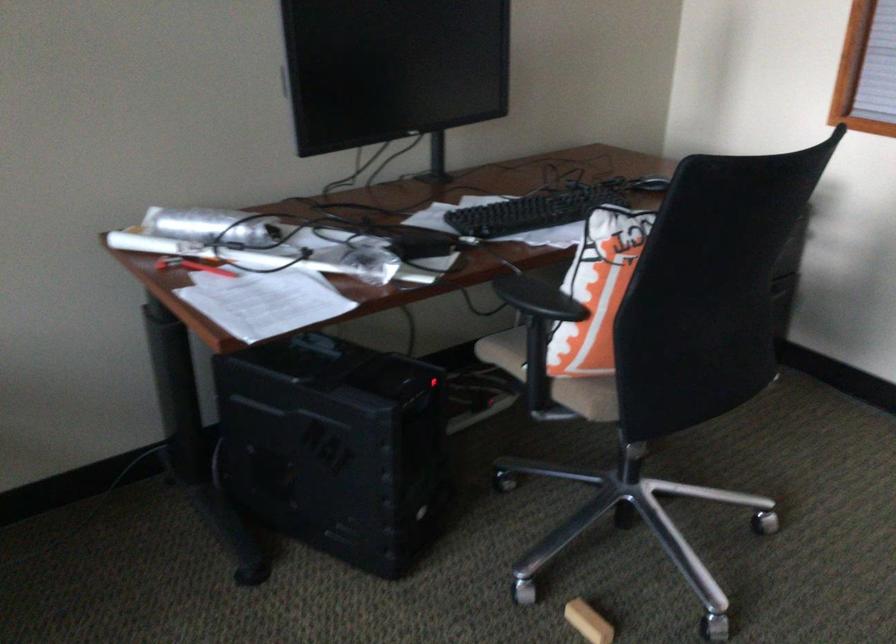
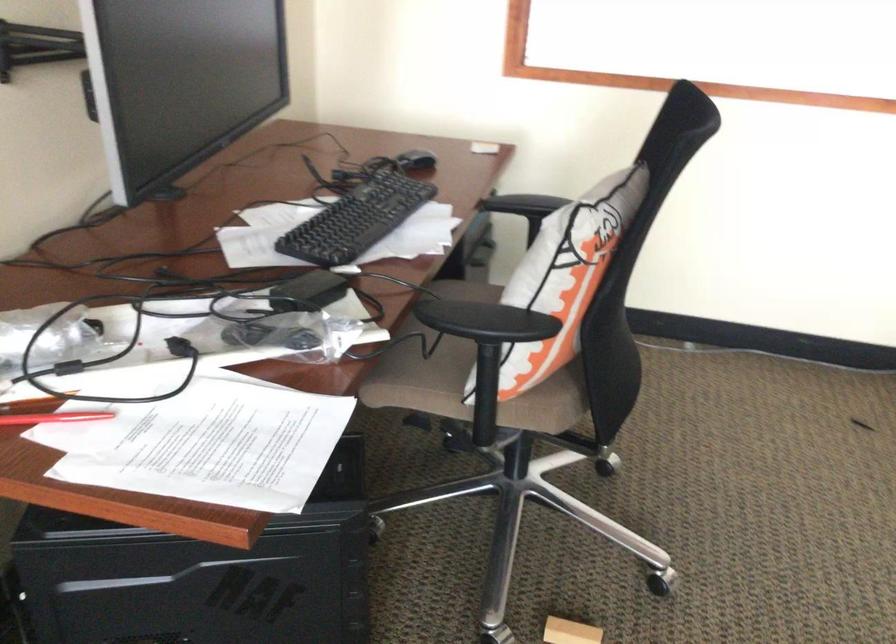
In the second image, find the point that corresponds to (x=207, y=270) in the first image.

(54, 418)